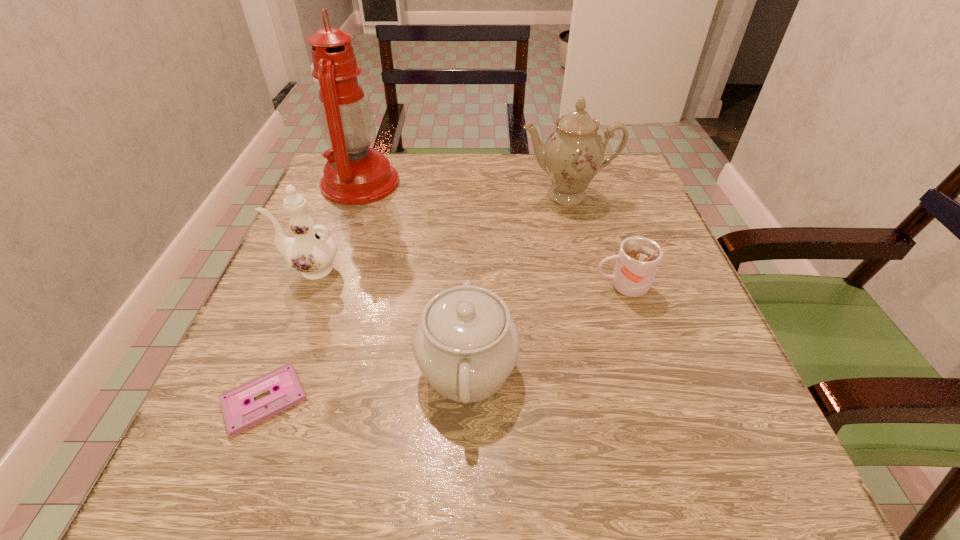
Find the location of a particular element. vacant space at the right edge of the desktop is located at coordinates (717, 406).

Identify the location of free space at the far left corner. (323, 200).

Find the location of a particular element. This screenshot has width=960, height=540. vacant space at the near left corner of the desktop is located at coordinates (205, 480).

In order to click on vacant space at the far right corner of the desktop in this screenshot , I will do `click(598, 177)`.

Where is `vacant area at the near right corner`? The image size is (960, 540). vacant area at the near right corner is located at coordinates click(772, 448).

At what (x,y) coordinates should I click in order to perform the action: click on free spot between the shortest object and the second farthest chinaware. Please return your answer as a coordinate pair (x, y). The image size is (960, 540). Looking at the image, I should click on (287, 334).

This screenshot has width=960, height=540. I want to click on free spot between the fifth tallest object and the second farthest chinaware, so click(x=467, y=278).

Where is `free area in between the leftmost chinaware and the second chinaware from right to left`? free area in between the leftmost chinaware and the second chinaware from right to left is located at coordinates (389, 319).

What are the coordinates of `vacant area between the shortest object and the oil lamp` in the screenshot? It's located at (312, 291).

Find the location of a particular element. vacant area between the tallest object and the fifth tallest object is located at coordinates (492, 235).